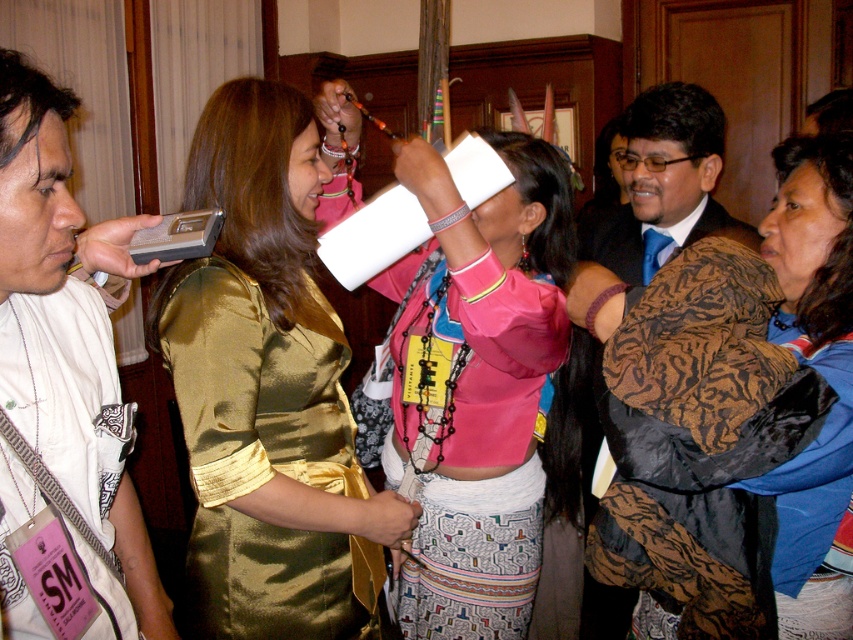
Question: Does gold satin dress at center have a smaller size compared to pink satin blouse at center?

Choices:
 (A) yes
 (B) no

Answer: (A)

Question: Estimate the real-world distances between objects in this image. Which object is farther from the pink satin blouse at center?

Choices:
 (A) gold satin dress at center
 (B) white fabric at left

Answer: (B)

Question: Estimate the real-world distances between objects in this image. Which object is closer to the pink satin blouse at center?

Choices:
 (A) gold satin dress at center
 (B) white fabric at left
 (C) patterned fabric scarf at center

Answer: (A)

Question: Does patterned fabric scarf at center lie behind gold satin dress at center?

Choices:
 (A) no
 (B) yes

Answer: (A)

Question: Among these objects, which one is nearest to the camera?

Choices:
 (A) white fabric at left
 (B) pink satin blouse at center
 (C) patterned fabric scarf at center
 (D) gold satin dress at center

Answer: (A)

Question: Observing the image, what is the correct spatial positioning of patterned fabric scarf at center in reference to gold satin dress at center?

Choices:
 (A) below
 (B) above

Answer: (A)